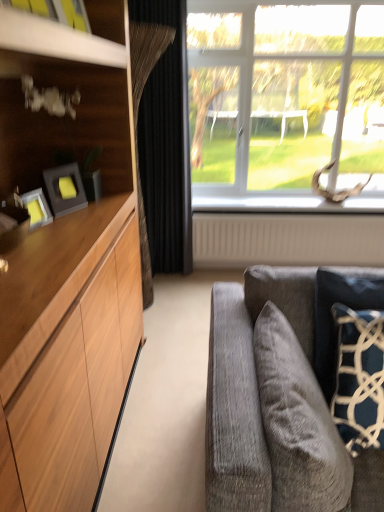
Question: Could you tell me if beige textured radiator at lower center is turned towards matte black picture frame at left?

Choices:
 (A) yes
 (B) no

Answer: (B)

Question: From the image's perspective, would you say beige textured radiator at lower center is positioned over matte black picture frame at left?

Choices:
 (A) yes
 (B) no

Answer: (B)

Question: Is the depth of beige textured radiator at lower center less than that of matte black picture frame at left?

Choices:
 (A) no
 (B) yes

Answer: (A)

Question: Can you confirm if beige textured radiator at lower center is smaller than matte black picture frame at left?

Choices:
 (A) yes
 (B) no

Answer: (B)

Question: From a real-world perspective, does beige textured radiator at lower center sit lower than matte black picture frame at left?

Choices:
 (A) no
 (B) yes

Answer: (B)

Question: Is beige textured radiator at lower center shorter than matte black picture frame at left?

Choices:
 (A) no
 (B) yes

Answer: (A)

Question: From the image's perspective, is clear glass window at upper right below beige textured radiator at lower center?

Choices:
 (A) yes
 (B) no

Answer: (B)

Question: Can you confirm if clear glass window at upper right is taller than beige textured radiator at lower center?

Choices:
 (A) no
 (B) yes

Answer: (B)

Question: Is clear glass window at upper right to the right of beige textured radiator at lower center from the viewer's perspective?

Choices:
 (A) no
 (B) yes

Answer: (B)

Question: Can you confirm if clear glass window at upper right is positioned to the left of beige textured radiator at lower center?

Choices:
 (A) yes
 (B) no

Answer: (B)

Question: Considering the relative sizes of clear glass window at upper right and beige textured radiator at lower center in the image provided, is clear glass window at upper right smaller than beige textured radiator at lower center?

Choices:
 (A) yes
 (B) no

Answer: (B)

Question: Is beige textured radiator at lower center at the back of clear glass window at upper right?

Choices:
 (A) yes
 (B) no

Answer: (B)

Question: Is dark blue textured pillow at right, which is counted as the first pillow, starting from the right, to the right of velvet gray pillow at lower right, the second pillow from the right, from the viewer's perspective?

Choices:
 (A) yes
 (B) no

Answer: (A)